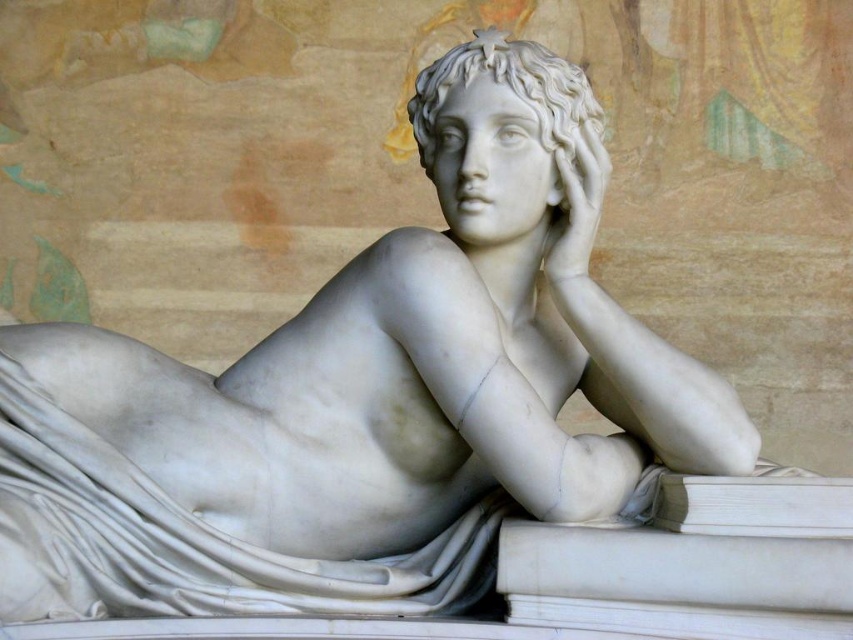
Question: Which of the following is the closest to the observer?

Choices:
 (A) (521, 84)
 (B) (582, 268)

Answer: (A)

Question: Does white marble head at center appear on the left side of white marble hand at upper center?

Choices:
 (A) no
 (B) yes

Answer: (B)

Question: Does white marble head at center come behind white marble hand at upper center?

Choices:
 (A) no
 (B) yes

Answer: (A)

Question: Can you confirm if white marble head at center is smaller than white marble hand at upper center?

Choices:
 (A) yes
 (B) no

Answer: (B)

Question: Which object appears closest to the camera in this image?

Choices:
 (A) white marble hand at upper center
 (B) white marble head at center

Answer: (B)